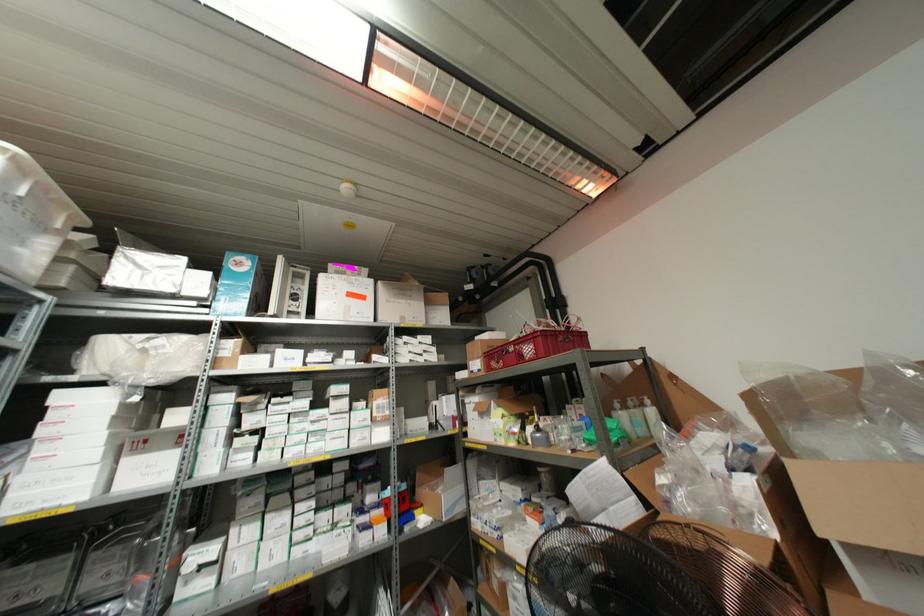
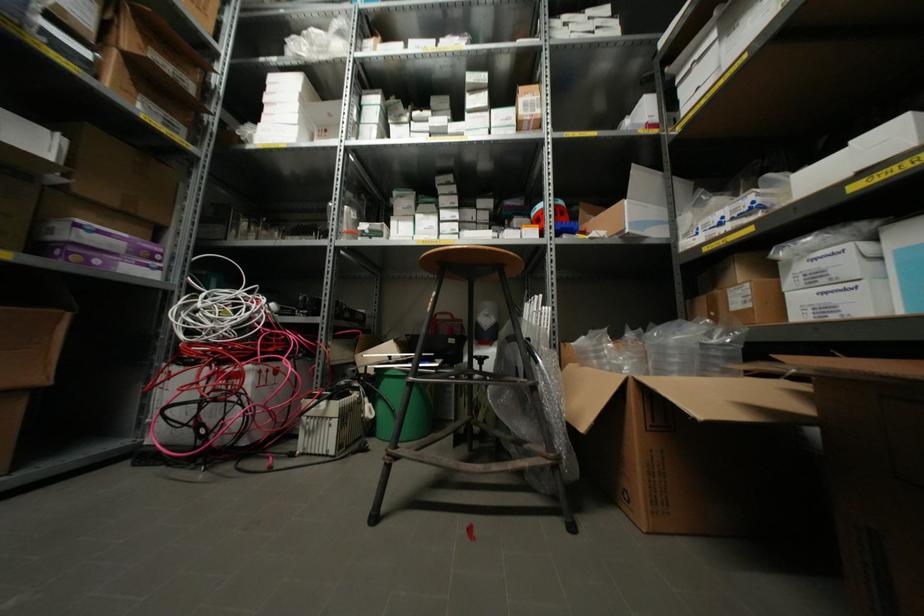
The point at (484, 447) is marked in the first image. Where is the corresponding point in the second image?

(743, 55)